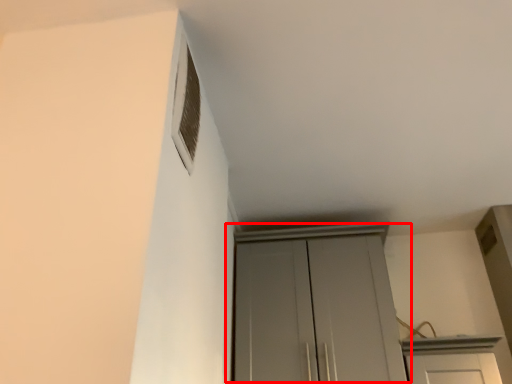
Question: Considering the relative positions of cupboard (annotated by the red box) and window in the image provided, where is cupboard (annotated by the red box) located with respect to the staircase?

Choices:
 (A) right
 (B) left

Answer: (A)